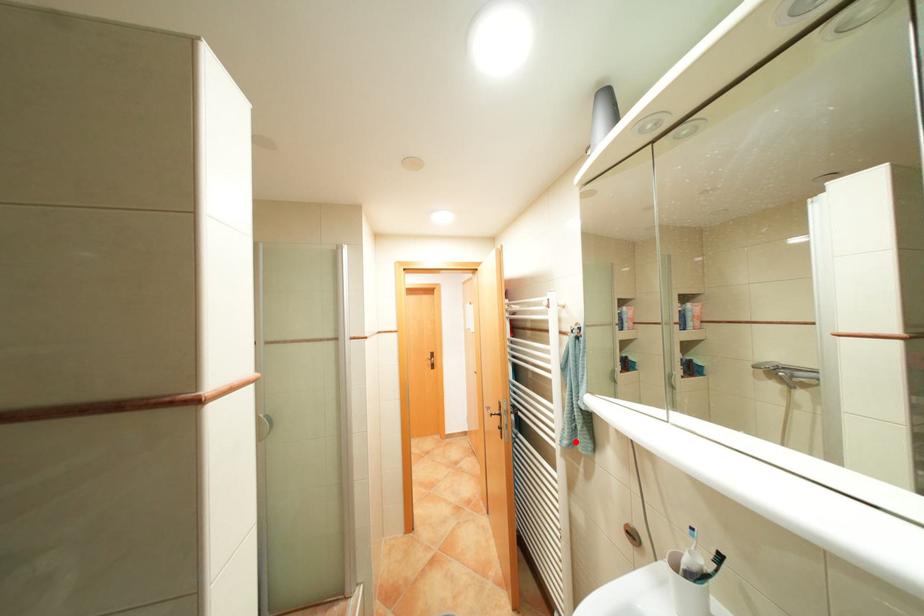
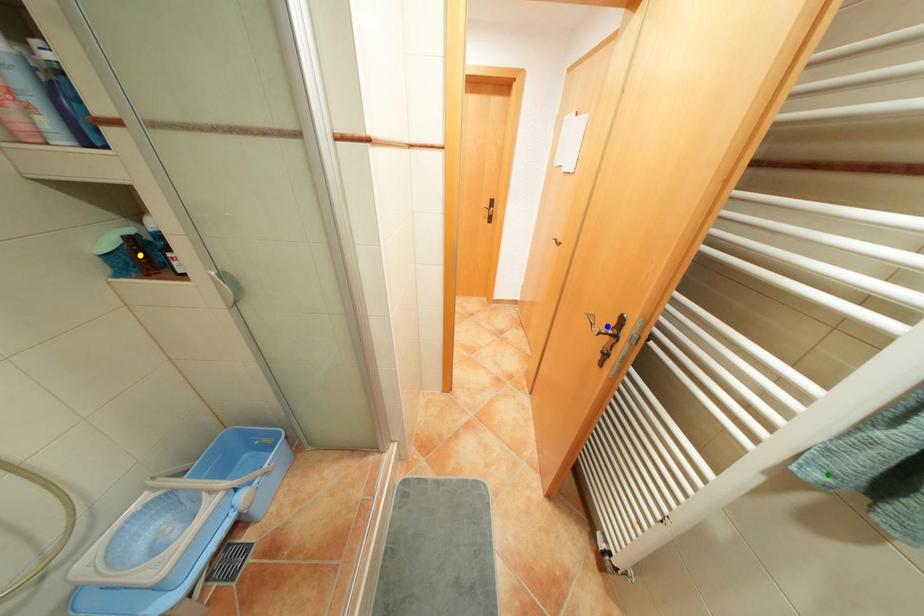
Question: I am providing you with two images of the same scene from different viewpoints. A red point is marked on the first image. You are given multiple points on the second image. Can you choose the point in image 2 that corresponds to the point in image 1?

Choices:
 (A) green point
 (B) blue point
 (C) yellow point

Answer: (A)